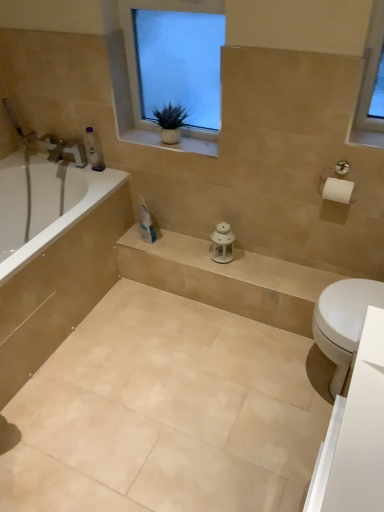
Locate an element on the screen. vacant space in front of translucent plastic bottle at upper left is located at coordinates (102, 178).